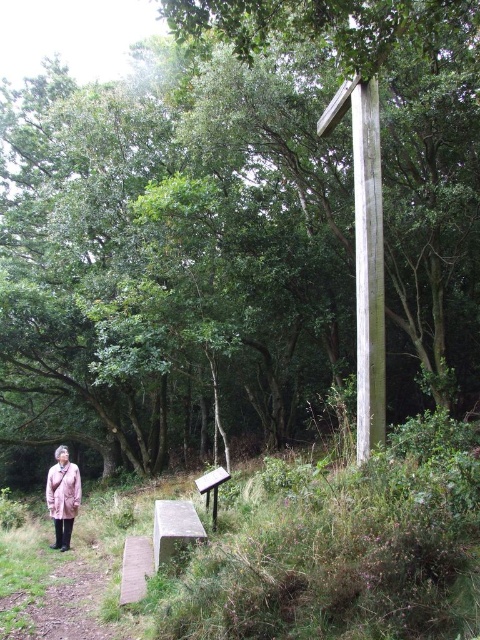
Consider the image. You are a park visitor carrying a 10 feet long banner. You want to place it between the weathered wood pole at right and the brown wooden bench at lower center. Is there enough space to lay it flat without bending the banner?

The distance between the weathered wood pole at right and the brown wooden bench at lower center is 9.70 feet. Since the banner is 10 feet long, it is slightly longer than the available space. You would need to bend or fold the banner to fit it within the 9.70 feet distance.

You are a hiker who wants to rest on the brown wooden bench at lower center. However, you notice a weathered wood pole at right. Is the pole positioned above or below the bench?

The weathered wood pole at right is located above the brown wooden bench at lower center, so the pole is positioned above the bench.